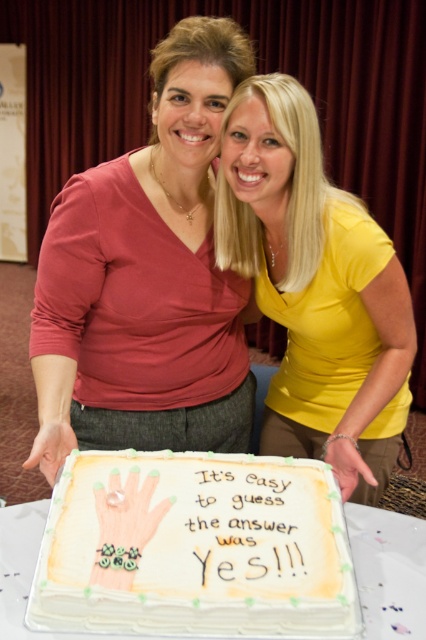
Is ivory fondant cake at center further to camera compared to yellow matte shirt at center?

No, ivory fondant cake at center is closer to the viewer.

Who is lower down, ivory fondant cake at center or yellow matte shirt at center?

ivory fondant cake at center is lower down.

Where is `ivory fondant cake at center`? Image resolution: width=426 pixels, height=640 pixels. ivory fondant cake at center is located at coordinates (195, 547).

Locate an element on the screen. The height and width of the screenshot is (640, 426). ivory fondant cake at center is located at coordinates (195, 547).

In the scene shown: Is matte red blouse at center thinner than ivory fondant cake at center?

In fact, matte red blouse at center might be wider than ivory fondant cake at center.

You are a GUI agent. You are given a task and a screenshot of the screen. Output one action in this format:
    pyautogui.click(x=<x>, y=<y>)
    Task: Click on the matte red blouse at center
    Image resolution: width=426 pixels, height=640 pixels.
    Given the screenshot: What is the action you would take?
    pyautogui.click(x=146, y=278)

Identify the location of matte red blouse at center. (146, 278).

Who is higher up, matte red blouse at center or yellow matte shirt at center?

matte red blouse at center is above.

Is matte red blouse at center thinner than yellow matte shirt at center?

Incorrect, matte red blouse at center's width is not less than yellow matte shirt at center's.

You are a GUI agent. You are given a task and a screenshot of the screen. Output one action in this format:
    pyautogui.click(x=<x>, y=<y>)
    Task: Click on the matte red blouse at center
    
    Given the screenshot: What is the action you would take?
    pyautogui.click(x=146, y=278)